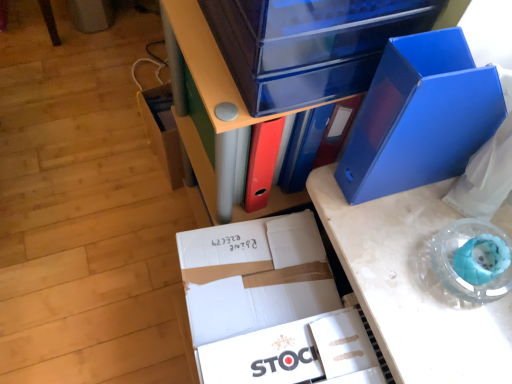
The height and width of the screenshot is (384, 512). In order to click on free location to the left of matte plastic storage box at lower left, the 2th storage box positioned from the front in this screenshot , I will do `click(122, 160)`.